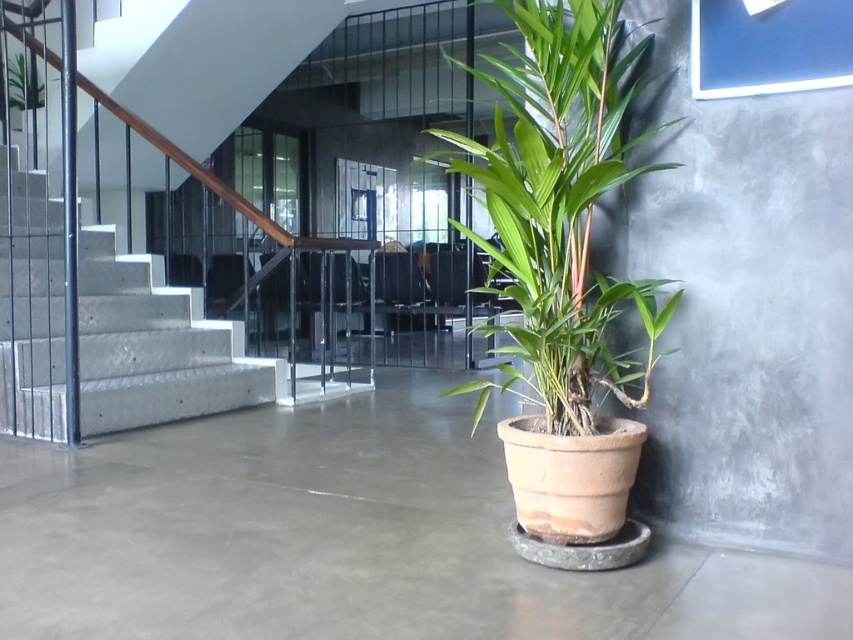
You are an office worker who wants to place a new potted plant on the polished concrete floor. You have two options from the image, the green matte plant at center and the green leafy plant at upper left. Which one is located to the right side of the other?

The green matte plant at center is positioned on the right side of green leafy plant at upper left, so the green matte plant at center is to the right of the green leafy plant at upper left.

From the picture: You are standing at the bottom of the staircase and want to walk towards the potted plant. Which point, point (157, 330) or point (10, 67), is closer to your starting position?

Point (10, 67) is closer to your starting position because it is behind point (157, 330), meaning the latter is further away from you.